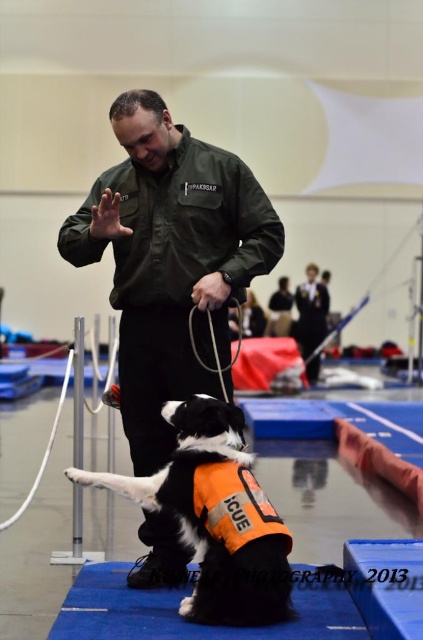
Is green matte shirt at center to the right of orange fabric life jacket at center from the viewer's perspective?

In fact, green matte shirt at center is to the left of orange fabric life jacket at center.

Based on the photo, can you confirm if green matte shirt at center is wider than orange fabric life jacket at center?

Yes, green matte shirt at center is wider than orange fabric life jacket at center.

Where is `green matte shirt at center`? The height and width of the screenshot is (640, 423). green matte shirt at center is located at coordinates (170, 260).

Can you confirm if black and white fur at center is taller than orange fabric life jacket at center?

Yes, black and white fur at center is taller than orange fabric life jacket at center.

Who is more forward, (156,481) or (227,467)?

Point (227,467) is in front.

This screenshot has width=423, height=640. I want to click on black and white fur at center, so click(216, 515).

Does point (186, 381) come behind point (238, 525)?

That is True.

Does green matte shirt at center lie in front of black and white fur at center?

That is False.

Between point (159, 346) and point (227, 476), which one is positioned in front?

Positioned in front is point (227, 476).

The image size is (423, 640). Find the location of `green matte shirt at center`. green matte shirt at center is located at coordinates (170, 260).